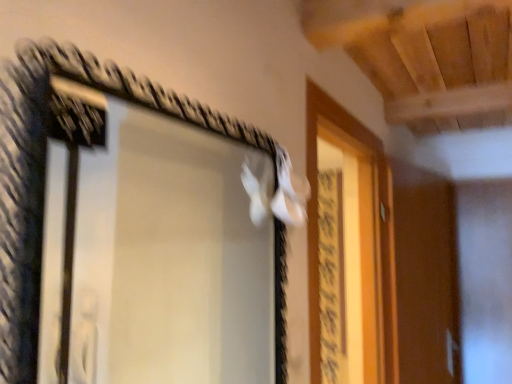
Question: Considering the positions of point [x=95, y=205] and point [x=346, y=329], is point [x=95, y=205] closer or farther from the camera than point [x=346, y=329]?

Choices:
 (A) farther
 (B) closer

Answer: (B)

Question: From a real-world perspective, is black wire frame mirror at upper left positioned above or below white matte screen door at upper right?

Choices:
 (A) below
 (B) above

Answer: (B)

Question: Is black wire frame mirror at upper left to the left or to the right of white matte screen door at upper right in the image?

Choices:
 (A) left
 (B) right

Answer: (A)

Question: In terms of size, does white matte screen door at upper right appear bigger or smaller than black wire frame mirror at upper left?

Choices:
 (A) small
 (B) big

Answer: (B)

Question: Considering the positions of white matte screen door at upper right and black wire frame mirror at upper left in the image, is white matte screen door at upper right wider or thinner than black wire frame mirror at upper left?

Choices:
 (A) wide
 (B) thin

Answer: (A)

Question: Considering the relative positions of white matte screen door at upper right and black wire frame mirror at upper left in the image provided, is white matte screen door at upper right to the left or to the right of black wire frame mirror at upper left?

Choices:
 (A) left
 (B) right

Answer: (B)

Question: From a real-world perspective, is white matte screen door at upper right positioned above or below black wire frame mirror at upper left?

Choices:
 (A) above
 (B) below

Answer: (B)